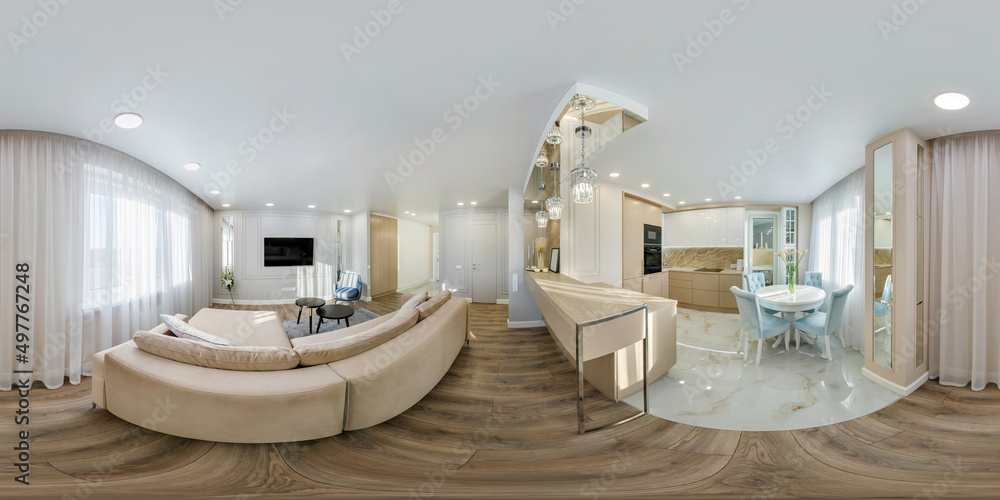
In order to click on ceiling in this screenshot , I will do `click(401, 101)`, `click(728, 81)`.